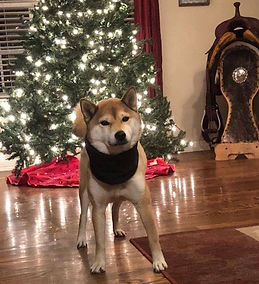
What are the coordinates of `rug` in the screenshot? It's located at (227, 256).